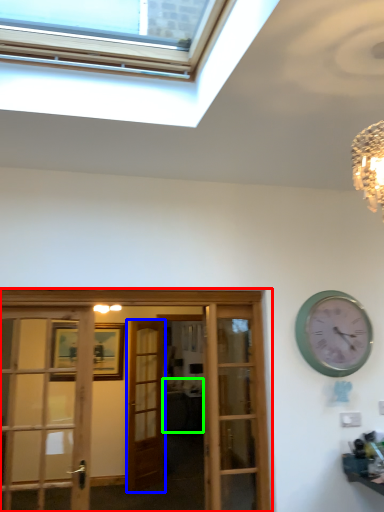
Question: Which object is the closest to the hotel lobby (highlighted by a red box)? Choose among these: door (highlighted by a blue box) or studio couch (highlighted by a green box).

Choices:
 (A) door
 (B) studio couch

Answer: (A)